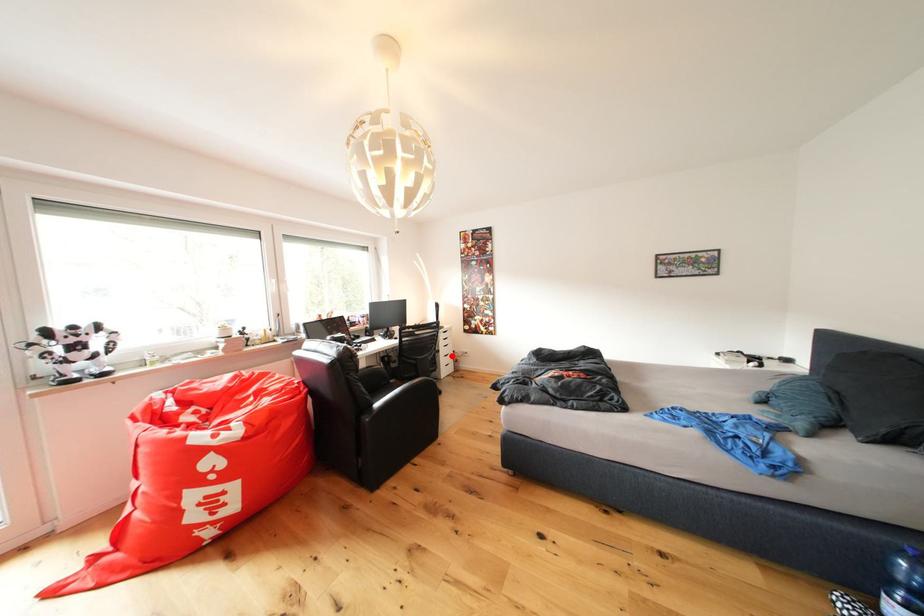
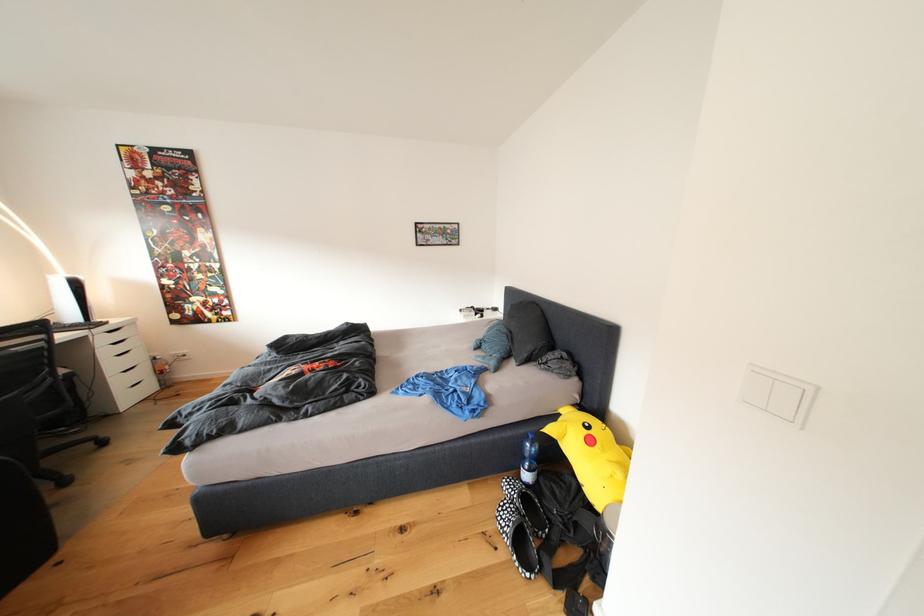
Question: I am providing you with two images of the same scene from different viewpoints. A red point is marked on the first image. At the location where the point appears in image 1, is it still visible in image 2?

Choices:
 (A) Yes
 (B) No

Answer: (A)